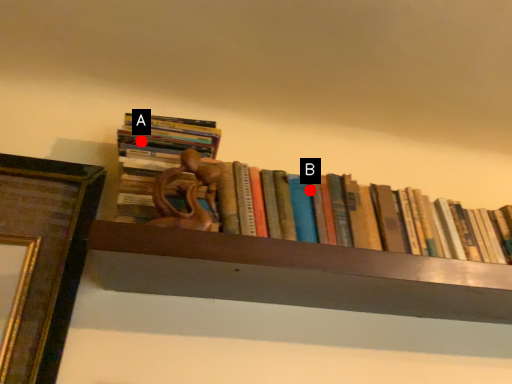
Question: Two points are circled on the image, labeled by A and B beside each circle. Which of the following is the closest to the observer?

Choices:
 (A) A is closer
 (B) B is closer

Answer: (A)